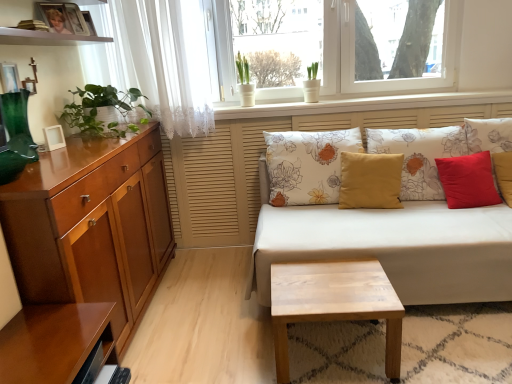
Locate an element on the screen. The width and height of the screenshot is (512, 384). vacant area that is situated to the right of light wood/texture coffee table at center is located at coordinates (437, 347).